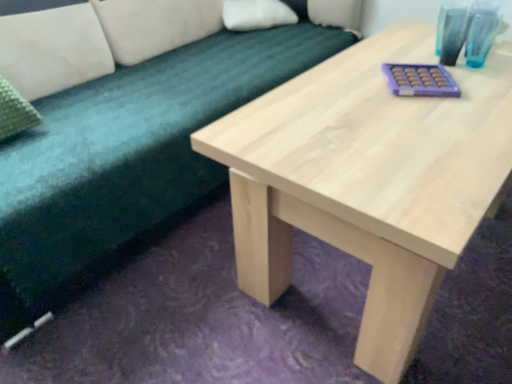
Question: From the image's perspective, is natural wood table at center on top of white soft pillow at upper center?

Choices:
 (A) yes
 (B) no

Answer: (B)

Question: Is natural wood table at center outside white soft pillow at upper center?

Choices:
 (A) no
 (B) yes

Answer: (B)

Question: Does natural wood table at center appear on the left side of white soft pillow at upper center?

Choices:
 (A) no
 (B) yes

Answer: (A)

Question: Does natural wood table at center have a lesser height compared to white soft pillow at upper center?

Choices:
 (A) yes
 (B) no

Answer: (A)

Question: Is natural wood table at center smaller than white soft pillow at upper center?

Choices:
 (A) yes
 (B) no

Answer: (B)

Question: Could you tell me if natural wood table at center is facing white soft pillow at upper center?

Choices:
 (A) yes
 (B) no

Answer: (B)

Question: From a real-world perspective, does soft green fabric couch at upper left sit lower than white soft pillow at upper center?

Choices:
 (A) no
 (B) yes

Answer: (B)

Question: Is the position of soft green fabric couch at upper left more distant than that of white soft pillow at upper center?

Choices:
 (A) yes
 (B) no

Answer: (B)

Question: Is soft green fabric couch at upper left oriented away from white soft pillow at upper center?

Choices:
 (A) yes
 (B) no

Answer: (A)

Question: Can you confirm if soft green fabric couch at upper left is positioned to the right of white soft pillow at upper center?

Choices:
 (A) yes
 (B) no

Answer: (B)

Question: Could you tell me if soft green fabric couch at upper left is turned towards white soft pillow at upper center?

Choices:
 (A) no
 (B) yes

Answer: (A)

Question: Considering the relative sizes of soft green fabric couch at upper left and white soft pillow at upper center in the image provided, is soft green fabric couch at upper left bigger than white soft pillow at upper center?

Choices:
 (A) yes
 (B) no

Answer: (A)

Question: From a real-world perspective, is soft green fabric couch at upper left on clear glass vase at upper right?

Choices:
 (A) yes
 (B) no

Answer: (B)